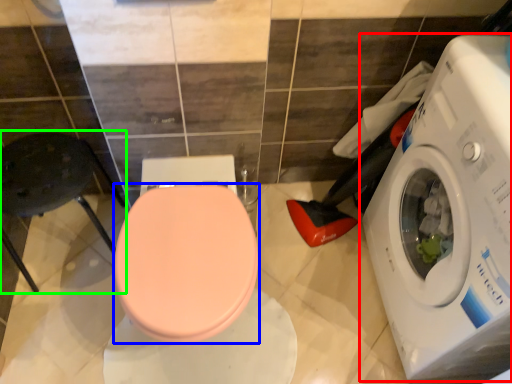
Question: Which object is positioned farthest from washing machine (highlighted by a red box)? Select from bidet (highlighted by a blue box) and chair (highlighted by a green box).

Choices:
 (A) bidet
 (B) chair

Answer: (B)